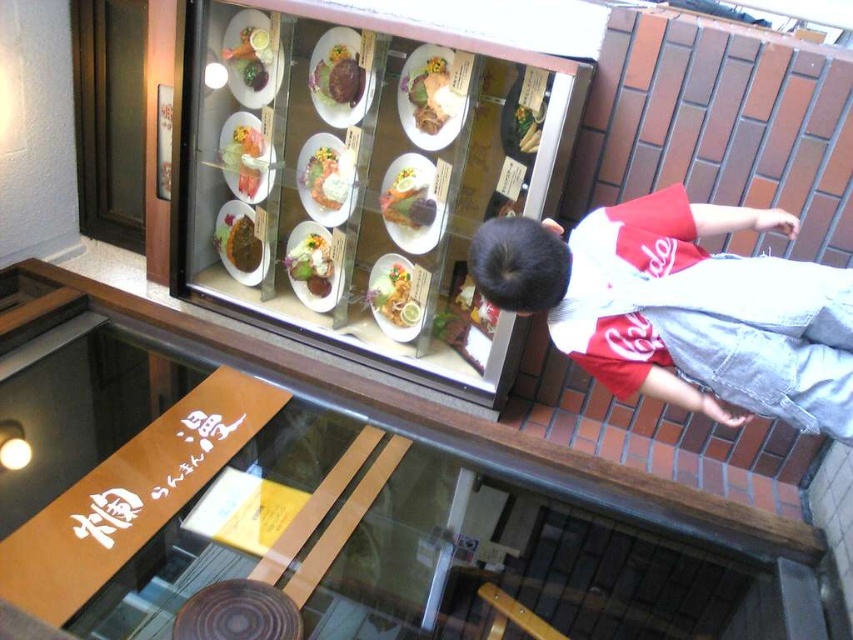
Question: Which point is farther to the camera?

Choices:
 (A) matte brown plate at center
 (B) smooth white plate at upper center
 (C) shiny white plate at center

Answer: (A)

Question: Is shiny white plate at center positioned at the back of brown matte meat at center?

Choices:
 (A) no
 (B) yes

Answer: (A)

Question: Which point is closer to the camera taking this photo?

Choices:
 (A) (268, 260)
 (B) (318, 154)

Answer: (B)

Question: Can you confirm if golden fried shrimp at center is positioned to the left of golden brown steak at center?

Choices:
 (A) no
 (B) yes

Answer: (A)

Question: Which point is farther from the camera taking this photo?

Choices:
 (A) (306, 278)
 (B) (264, 81)
 (C) (225, 154)

Answer: (A)

Question: Is the position of brown wooden ledge at upper center more distant than that of smooth white plate at center?

Choices:
 (A) yes
 (B) no

Answer: (B)